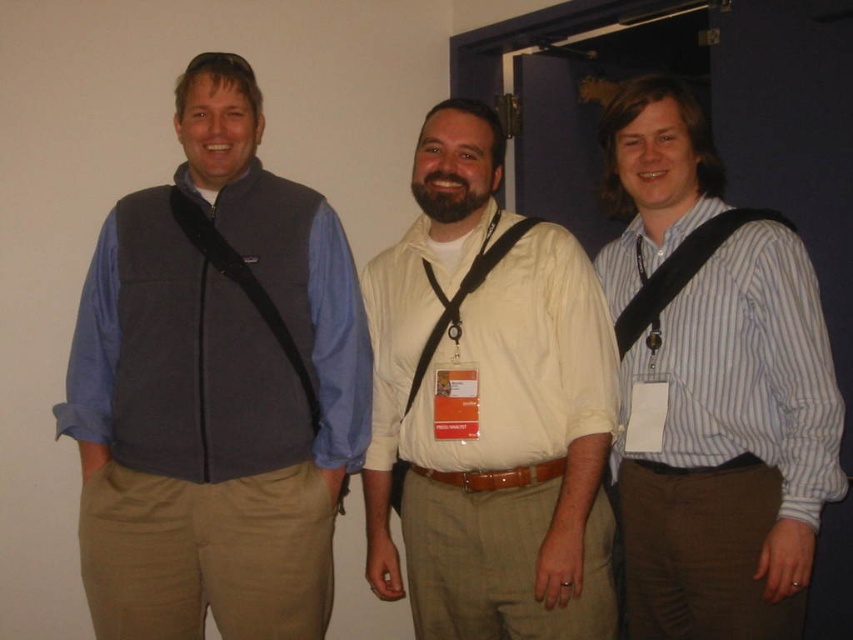
Consider the image. Does matte blue vest at left have a greater height compared to light beige shirt at center?

Correct, matte blue vest at left is much taller as light beige shirt at center.

Which is behind, point (190, 326) or point (474, 205)?

Positioned behind is point (190, 326).

Measure the distance between matte blue vest at left and camera.

matte blue vest at left and camera are 1.73 meters apart.

You are a GUI agent. You are given a task and a screenshot of the screen. Output one action in this format:
    pyautogui.click(x=<x>, y=<y>)
    Task: Click on the matte blue vest at left
    
    Given the screenshot: What is the action you would take?
    pyautogui.click(x=213, y=392)

Is matte blue vest at left smaller than black fleece strap at left?

Incorrect, matte blue vest at left is not smaller in size than black fleece strap at left.

Which is more to the left, matte blue vest at left or black fleece strap at left?

From the viewer's perspective, matte blue vest at left appears more on the left side.

You are a GUI agent. You are given a task and a screenshot of the screen. Output one action in this format:
    pyautogui.click(x=<x>, y=<y>)
    Task: Click on the matte blue vest at left
    
    Given the screenshot: What is the action you would take?
    pyautogui.click(x=213, y=392)

Locate an element on the screen. This screenshot has width=853, height=640. matte blue vest at left is located at coordinates (213, 392).

Which is more to the left, black fabric strap at right or black fleece strap at left?

Positioned to the left is black fleece strap at left.

Can you confirm if black fabric strap at right is shorter than black fleece strap at left?

Correct, black fabric strap at right is not as tall as black fleece strap at left.

Describe the element at coordinates (682, 269) in the screenshot. I see `black fabric strap at right` at that location.

The width and height of the screenshot is (853, 640). What are the coordinates of `black fabric strap at right` in the screenshot? It's located at (682, 269).